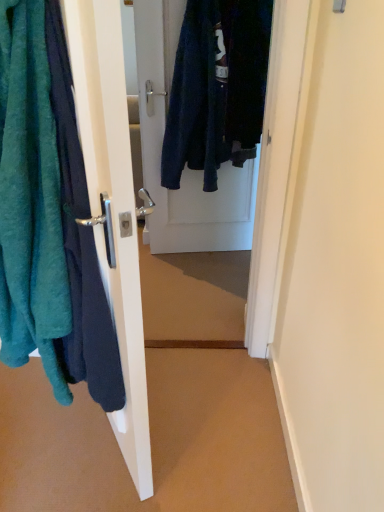
What do you see at coordinates (30, 199) in the screenshot? Image resolution: width=384 pixels, height=512 pixels. I see `teal fuzzy towel at left` at bounding box center [30, 199].

Describe the element at coordinates (112, 205) in the screenshot. This screenshot has width=384, height=512. I see `matte white door handle at left, the 1th door positioned from the left` at that location.

Where is `velvet dark blue coat at center, which is the first door in back-to-front order`? velvet dark blue coat at center, which is the first door in back-to-front order is located at coordinates (201, 117).

Find the location of a particular element. teal fuzzy towel at left is located at coordinates (30, 199).

Measure the distance between teal fuzzy towel at left and matte white door handle at left, the first door from the front.

A distance of 7.46 inches exists between teal fuzzy towel at left and matte white door handle at left, the first door from the front.

Between teal fuzzy towel at left and matte white door handle at left, placed as the second door when sorted from right to left, which one has smaller size?

matte white door handle at left, placed as the second door when sorted from right to left.

Is teal fuzzy towel at left taller than matte white door handle at left, placed as the second door when sorted from right to left?

Incorrect, the height of teal fuzzy towel at left is not larger of that of matte white door handle at left, placed as the second door when sorted from right to left.

From a real-world perspective, is teal fuzzy towel at left physically located above or below matte white door handle at left, placed as the second door when sorted from right to left?

teal fuzzy towel at left is above matte white door handle at left, placed as the second door when sorted from right to left.

Considering the sizes of velvet dark blue coat at center, acting as the 2th door starting from the front, and matte white door handle at left, the first door from the front, in the image, is velvet dark blue coat at center, acting as the 2th door starting from the front, wider or thinner than matte white door handle at left, the first door from the front,?

Considering their sizes, velvet dark blue coat at center, acting as the 2th door starting from the front, looks slimmer than matte white door handle at left, the first door from the front.

How much distance is there between velvet dark blue coat at center, acting as the 2th door starting from the front, and matte white door handle at left, the 1th door positioned from the left?

They are 1.32 meters apart.

Considering the relative positions of velvet dark blue coat at center, the 2th door when ordered from left to right, and matte white door handle at left, the 1th door positioned from the left, in the image provided, is velvet dark blue coat at center, the 2th door when ordered from left to right, to the left or to the right of matte white door handle at left, the 1th door positioned from the left,?

From the image, it's evident that velvet dark blue coat at center, the 2th door when ordered from left to right, is to the right of matte white door handle at left, the 1th door positioned from the left.

Considering the relative sizes of velvet dark blue coat at center, the 2th door when ordered from left to right, and matte white door handle at left, placed as the second door when sorted from right to left, in the image provided, is velvet dark blue coat at center, the 2th door when ordered from left to right, smaller than matte white door handle at left, placed as the second door when sorted from right to left,?

Yes, velvet dark blue coat at center, the 2th door when ordered from left to right, is smaller than matte white door handle at left, placed as the second door when sorted from right to left.

From a real-world perspective, is teal fuzzy towel at left physically above velvet dark blue coat at center, which is the first door in back-to-front order?

Yes, from a real-world perspective, teal fuzzy towel at left is over velvet dark blue coat at center, which is the first door in back-to-front order

Can you tell me how much teal fuzzy towel at left and velvet dark blue coat at center, marked as the first door in a right-to-left arrangement, differ in facing direction?

75 degrees.

Is teal fuzzy towel at left taller or shorter than velvet dark blue coat at center, acting as the 2th door starting from the front?

teal fuzzy towel at left is shorter than velvet dark blue coat at center, acting as the 2th door starting from the front.

Does teal fuzzy towel at left turn towards velvet dark blue coat at center, which is the first door in back-to-front order?

No.

Between matte white door handle at left, the 1th door positioned from the left, and velvet dark blue coat at center, marked as the first door in a right-to-left arrangement, which one has smaller size?

With smaller size is velvet dark blue coat at center, marked as the first door in a right-to-left arrangement.

Considering the positions of objects matte white door handle at left, the 1th door positioned from the left, and velvet dark blue coat at center, marked as the first door in a right-to-left arrangement, in the image provided, who is behind, matte white door handle at left, the 1th door positioned from the left, or velvet dark blue coat at center, marked as the first door in a right-to-left arrangement,?

velvet dark blue coat at center, marked as the first door in a right-to-left arrangement.

Considering the positions of point (122, 91) and point (214, 78), is point (122, 91) closer or farther from the camera than point (214, 78)?

Point (122, 91).

Which is more to the left, matte white door handle at left, placed as the second door when sorted from right to left, or velvet dark blue coat at center, the 2th door when ordered from left to right?

matte white door handle at left, placed as the second door when sorted from right to left.

From the image's perspective, is velvet dark blue coat at center, the 2th door when ordered from left to right, on teal fuzzy towel at left?

Yes.

Which is more distant, (150, 79) or (22, 81)?

The point (150, 79) is behind.

Is velvet dark blue coat at center, acting as the 2th door starting from the front, closer to camera compared to teal fuzzy towel at left?

No, velvet dark blue coat at center, acting as the 2th door starting from the front, is further to the viewer.

Is velvet dark blue coat at center, which is the first door in back-to-front order, taller than teal fuzzy towel at left?

Yes, velvet dark blue coat at center, which is the first door in back-to-front order, is taller than teal fuzzy towel at left.

Can you confirm if matte white door handle at left, placed as the second door when sorted from right to left, is smaller than teal fuzzy towel at left?

Yes, matte white door handle at left, placed as the second door when sorted from right to left, is smaller than teal fuzzy towel at left.

From the image's perspective, is matte white door handle at left, the 1th door positioned from the left, located above or below teal fuzzy towel at left?

matte white door handle at left, the 1th door positioned from the left, is below teal fuzzy towel at left.

In terms of width, does matte white door handle at left, the first door from the front, look wider or thinner when compared to teal fuzzy towel at left?

matte white door handle at left, the first door from the front, is thinner than teal fuzzy towel at left.

Is matte white door handle at left, placed as the second door when sorted from right to left, facing away from teal fuzzy towel at left?

Yes, matte white door handle at left, placed as the second door when sorted from right to left,'s orientation is away from teal fuzzy towel at left.

This screenshot has width=384, height=512. What are the coordinates of `towel above the matte white door handle at left, the 1th door positioned from the left (from a real-world perspective)` in the screenshot? It's located at (30, 199).

Where is `door that is above the matte white door handle at left, the first door from the front (from the image's perspective)`? The width and height of the screenshot is (384, 512). door that is above the matte white door handle at left, the first door from the front (from the image's perspective) is located at coordinates (201, 117).

When comparing their distances from teal fuzzy towel at left, does matte white door handle at left, the first door from the front, or velvet dark blue coat at center, marked as the first door in a right-to-left arrangement, seem further?

velvet dark blue coat at center, marked as the first door in a right-to-left arrangement, is further to teal fuzzy towel at left.

When comparing their distances from velvet dark blue coat at center, which is the first door in back-to-front order, does matte white door handle at left, the first door from the front, or teal fuzzy towel at left seem closer?

matte white door handle at left, the first door from the front.

Based on their spatial positions, is velvet dark blue coat at center, acting as the 2th door starting from the front, or matte white door handle at left, the first door from the front, further from teal fuzzy towel at left?

velvet dark blue coat at center, acting as the 2th door starting from the front, lies further to teal fuzzy towel at left than the other object.

When comparing their distances from matte white door handle at left, the first door from the front, does velvet dark blue coat at center, marked as the first door in a right-to-left arrangement, or teal fuzzy towel at left seem further?

velvet dark blue coat at center, marked as the first door in a right-to-left arrangement.

Looking at the image, which one is located closer to velvet dark blue coat at center, the 2th door when ordered from left to right, teal fuzzy towel at left or matte white door handle at left, the first door from the front?

Based on the image, matte white door handle at left, the first door from the front, appears to be nearer to velvet dark blue coat at center, the 2th door when ordered from left to right.

From the image, which object appears to be nearer to matte white door handle at left, placed as the second door when sorted from right to left, teal fuzzy towel at left or velvet dark blue coat at center, marked as the first door in a right-to-left arrangement?

Based on the image, teal fuzzy towel at left appears to be nearer to matte white door handle at left, placed as the second door when sorted from right to left.

You are a GUI agent. You are given a task and a screenshot of the screen. Output one action in this format:
    pyautogui.click(x=<x>, y=<y>)
    Task: Click on the door between teal fuzzy towel at left and velvet dark blue coat at center, marked as the first door in a right-to-left arrangement, along the z-axis
    The width and height of the screenshot is (384, 512).
    Given the screenshot: What is the action you would take?
    pyautogui.click(x=112, y=205)